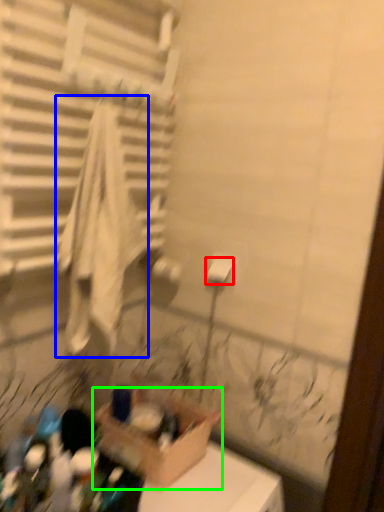
Question: Based on their relative distances, which object is farther from toilet paper (highlighted by a red box)? Choose from bath towel (highlighted by a blue box) and cardboard box (highlighted by a green box).

Choices:
 (A) bath towel
 (B) cardboard box

Answer: (B)